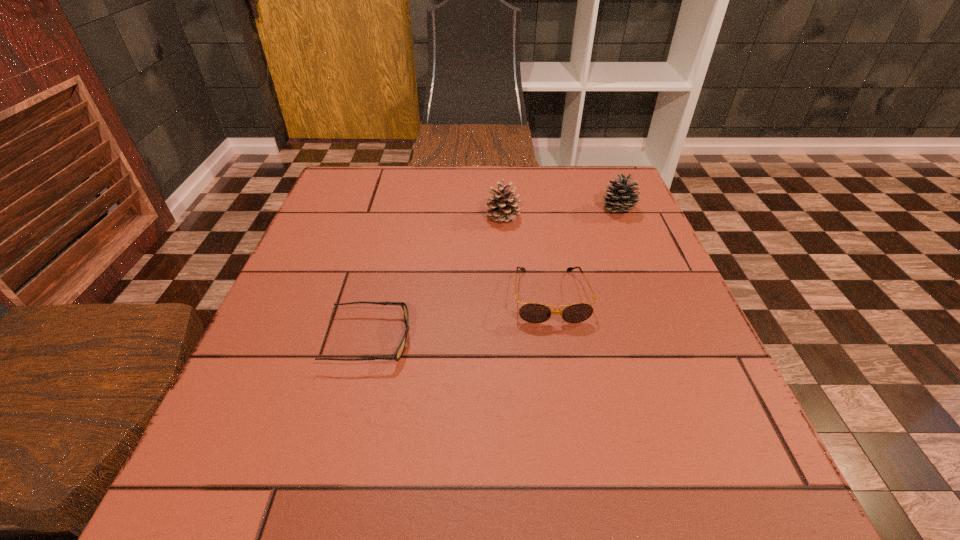
Identify the location of object that is at the left edge. (400, 349).

Find the location of a particular element. Image resolution: width=960 pixels, height=540 pixels. object located in the right edge section of the desktop is located at coordinates (620, 198).

This screenshot has width=960, height=540. I want to click on object that is at the far right corner, so coord(620,198).

Locate an element on the screen. This screenshot has width=960, height=540. free region at the far edge of the desktop is located at coordinates (559, 171).

This screenshot has width=960, height=540. Identify the location of vacant space at the near edge. (640, 497).

In the image, there is a desktop. Where is `vacant area at the left edge`? This screenshot has height=540, width=960. vacant area at the left edge is located at coordinates (331, 255).

This screenshot has width=960, height=540. In the image, there is a desktop. In order to click on vacant space at the right edge in this screenshot , I will do `click(620, 255)`.

You are a GUI agent. You are given a task and a screenshot of the screen. Output one action in this format:
    pyautogui.click(x=<x>, y=<y>)
    Task: Click on the vacant area at the far left corner
    This screenshot has width=960, height=540.
    Given the screenshot: What is the action you would take?
    pyautogui.click(x=348, y=171)

This screenshot has width=960, height=540. I want to click on vacant space at the far right corner of the desktop, so click(566, 173).

Image resolution: width=960 pixels, height=540 pixels. I want to click on free location at the near right corner of the desktop, so click(725, 462).